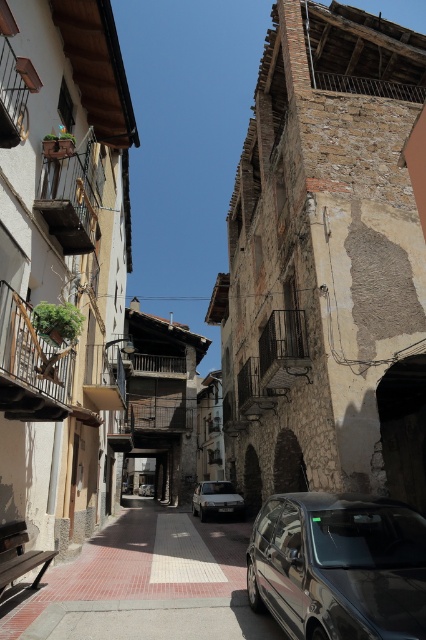
You are a delivery person who needs to park your vehicle in this narrow street. You have a delivery van similar to the glossy metallic van at lower right and a smaller delivery car similar to the silver metallic car at center. Which vehicle should you choose to ensure it fits in the available parking space without blocking the street?

You should choose the silver metallic car at center because the glossy metallic van at lower right is larger and might block the street due to its size.

You are a delivery person trying to park your vehicle in this narrow street. You see the smooth concrete pavement at center and the glossy metallic van at lower right. Which area is suitable for parking your vehicle?

The smooth concrete pavement at center is below the glossy metallic van at lower right, so the van is parked on the pavement. Therefore, the smooth concrete pavement at center is already occupied by the van and not available for parking. You should look for another spot.

You are a delivery person with a cart that is 2 meters long. You need to move from the smooth concrete pavement at center to the silver metallic car at center. Is there enough space between them for your cart to fit through?

The distance between the smooth concrete pavement at center and the silver metallic car at center is 5.41 meters. Since your cart is only 2 meters long, there is sufficient space for it to fit through the 5.41 meter gap between them.